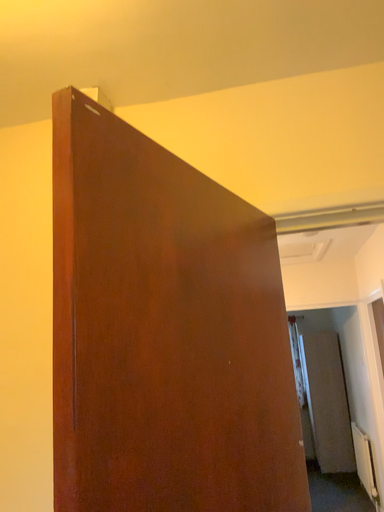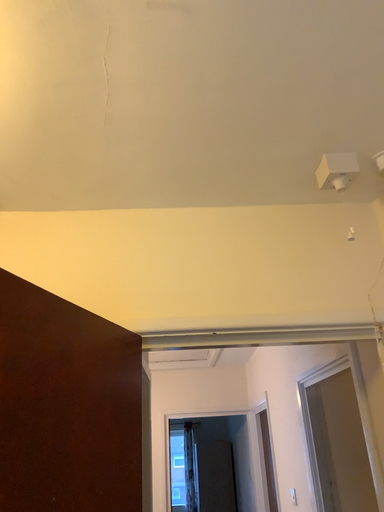
Question: How did the camera likely rotate when shooting the video?

Choices:
 (A) rotated downward
 (B) rotated upward

Answer: (B)